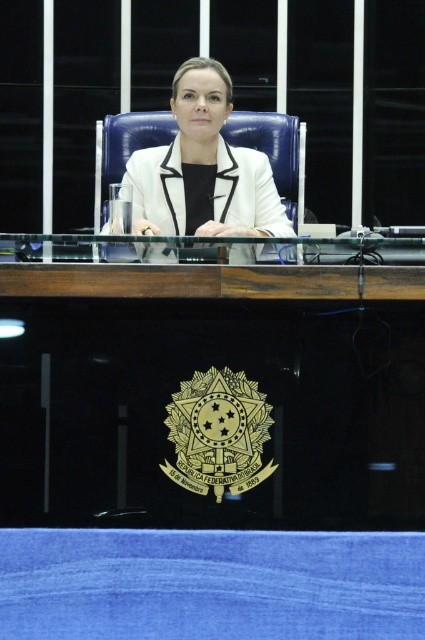
Does transparent glass table at center have a smaller size compared to white glossy blazer at center?

Correct, transparent glass table at center occupies less space than white glossy blazer at center.

The height and width of the screenshot is (640, 425). I want to click on transparent glass table at center, so click(212, 388).

Which is in front, point (351, 422) or point (246, 196)?

Point (351, 422)

Find the location of `transparent glass table at center`. transparent glass table at center is located at coordinates (212, 388).